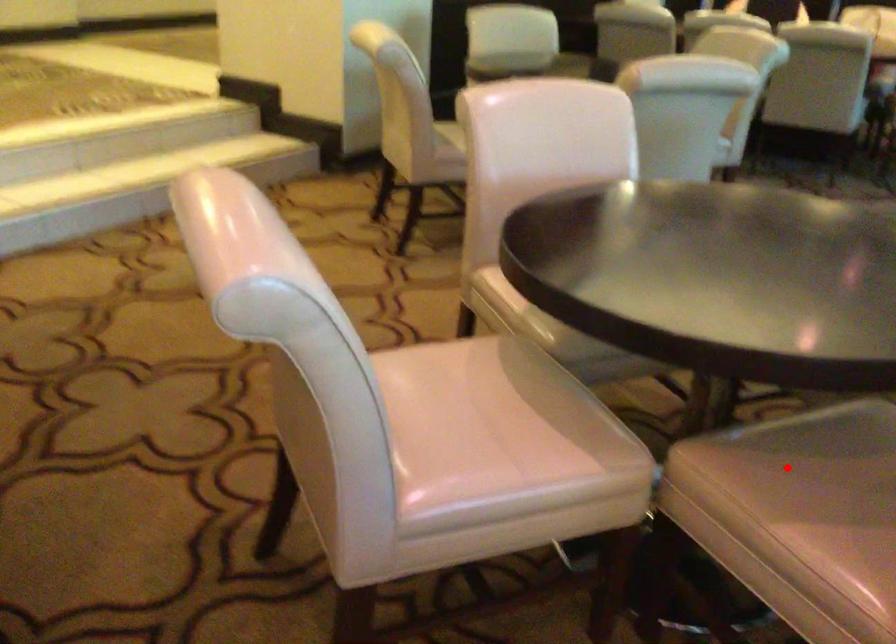
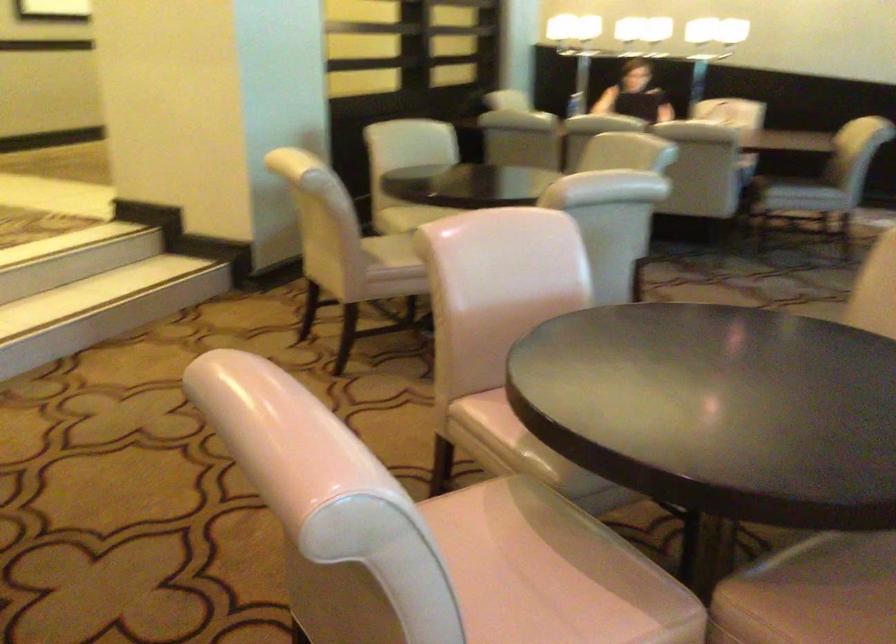
Question: I am providing you with two images of the same scene from different viewpoints. A red point is marked on the first image. At the location where the point appears in image 1, is it still visible in image 2?

Choices:
 (A) Yes
 (B) No

Answer: (A)